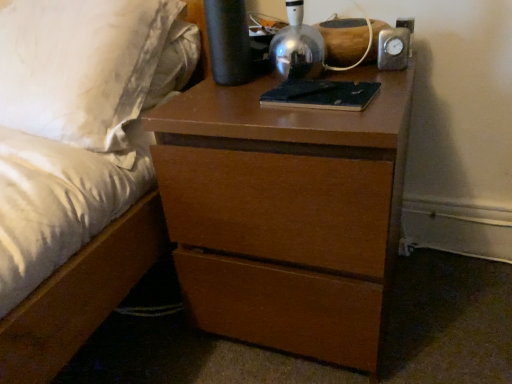
You are a GUI agent. You are given a task and a screenshot of the screen. Output one action in this format:
    pyautogui.click(x=<x>, y=<y>)
    Task: Click on the free spot to the right of brown wood chest of drawers at center
    
    Given the screenshot: What is the action you would take?
    pyautogui.click(x=445, y=300)